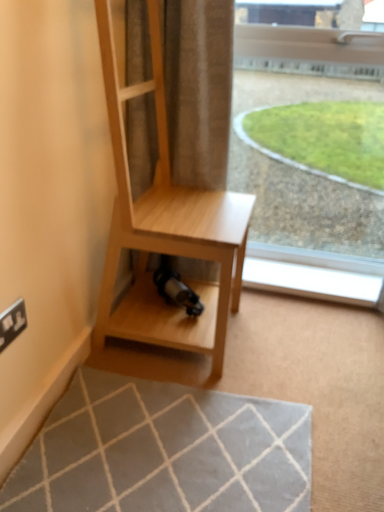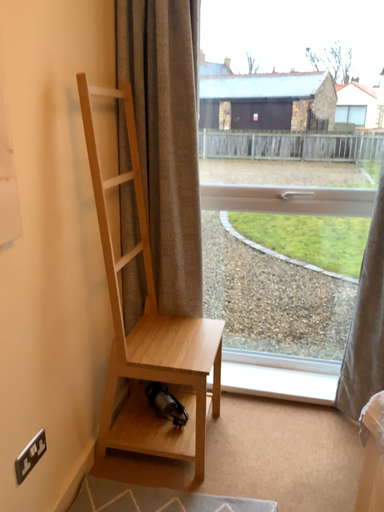
Question: How did the camera likely rotate when shooting the video?

Choices:
 (A) rotated downward
 (B) rotated upward

Answer: (B)